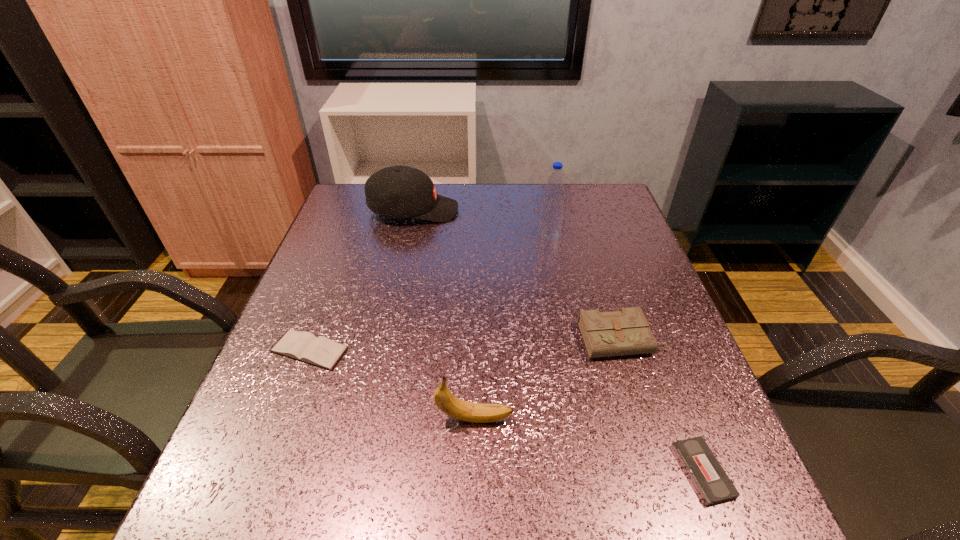
Select which object appears as the third closest to the fifth farthest object. Please provide its 2D coordinates. Your answer should be formatted as a tuple, i.e. [(x, y)], where the tuple contains the x and y coordinates of a point satisfying the conditions above.

[(713, 485)]

Locate which object ranks fifth in proximity to the banana. Please provide its 2D coordinates. Your answer should be formatted as a tuple, i.e. [(x, y)], where the tuple contains the x and y coordinates of a point satisfying the conditions above.

[(400, 191)]

Identify the location of vacant space that satisfies the following two spatial constraints: 1. at the start of the peel on the fifth farthest object; 2. on the right side of the nearest object. (474, 471).

Identify the location of free spot that satisfies the following two spatial constraints: 1. at the start of the peel on the fifth farthest object; 2. on the back side of the shortest object. (474, 471).

Identify the location of free point that satisfies the following two spatial constraints: 1. on the back side of the shorter diary; 2. on the left side of the third shortest object. (313, 339).

At what (x,y) coordinates should I click in order to perform the action: click on free location that satisfies the following two spatial constraints: 1. on the back side of the videotape; 2. with a logo on the front of the farthest object. Please return your answer as a coordinate pair (x, y). Looking at the image, I should click on (602, 211).

Locate an element on the screen. This screenshot has width=960, height=540. vacant space that satisfies the following two spatial constraints: 1. with a logo on the front of the farthest object; 2. on the front side of the left diary is located at coordinates (384, 350).